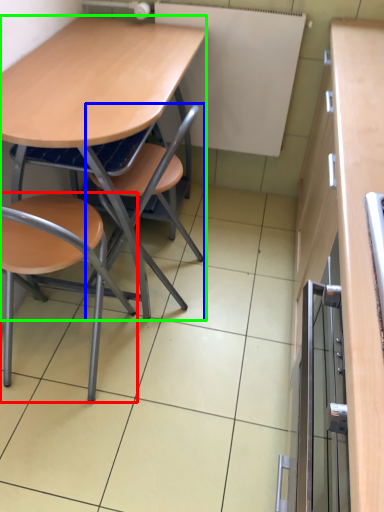
Question: Estimate the real-world distances between objects in this image. Which object is farther from chair (highlighted by a red box), chair (highlighted by a blue box) or desk (highlighted by a green box)?

Choices:
 (A) chair
 (B) desk

Answer: (B)